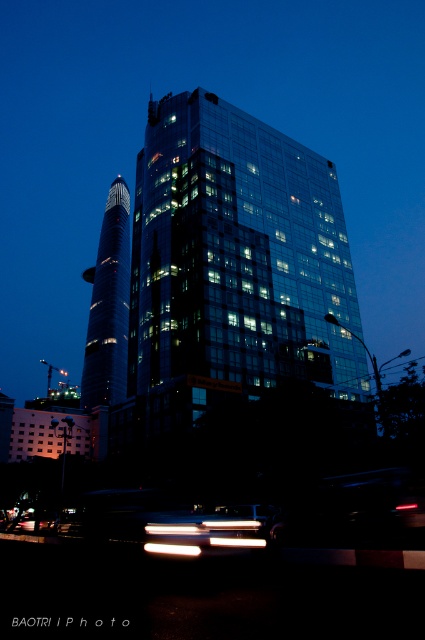
You are a delivery driver who needs to park your metallic silver car at lower center near the transparent glass building at center. Given that the parking spot is directly in front of the building, will the car be visible from the street?

The transparent glass building at center is taller than the metallic silver car at lower center, so the car will be visible from the street as it is shorter than the building.

You are a delivery driver who needs to park your metallic silver car at lower center near the transparent glass building at center. Can you park the car directly in front of the building?

The transparent glass building at center is located above the metallic silver car at lower center, meaning the car is already positioned below the building. Since the car is at lower center and the building is above it, the car is already parked directly in front of the transparent glass building at center.